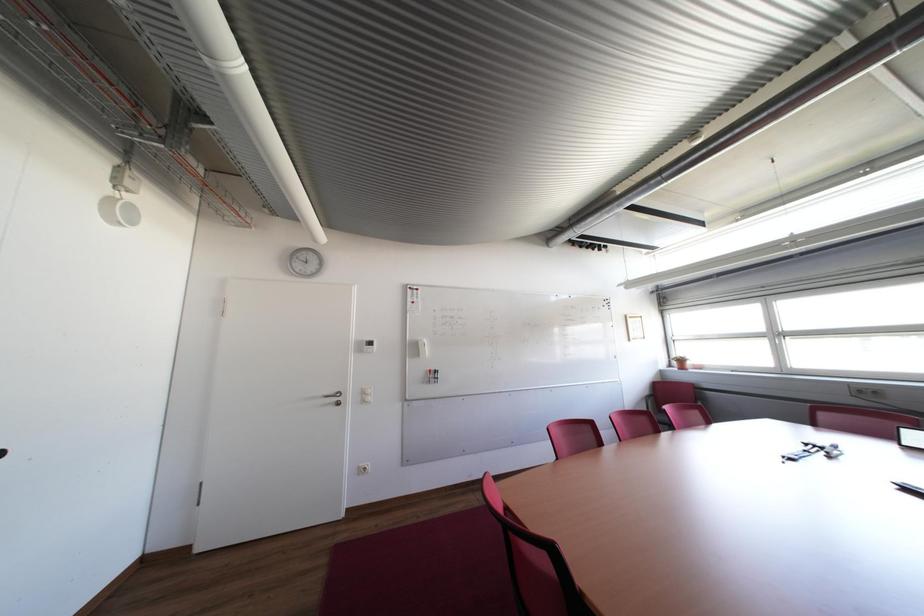
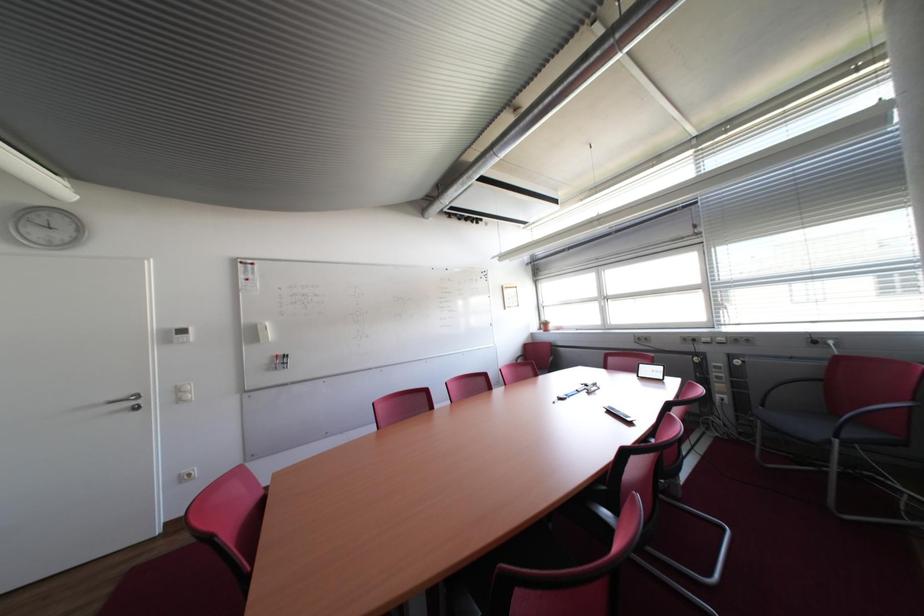
Question: The images are taken continuously from a first-person perspective. In which direction is your viewpoint rotating?

Choices:
 (A) Left
 (B) Right
 (C) Up
 (D) Down

Answer: (B)